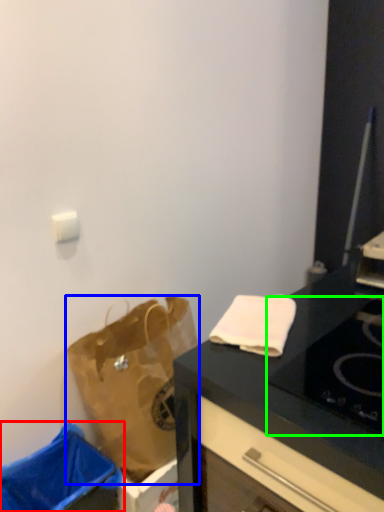
Question: Which object is the closest to the trash bin/can (highlighted by a red box)? Choose among these: handbag (highlighted by a blue box) or gas stove (highlighted by a green box).

Choices:
 (A) handbag
 (B) gas stove

Answer: (A)